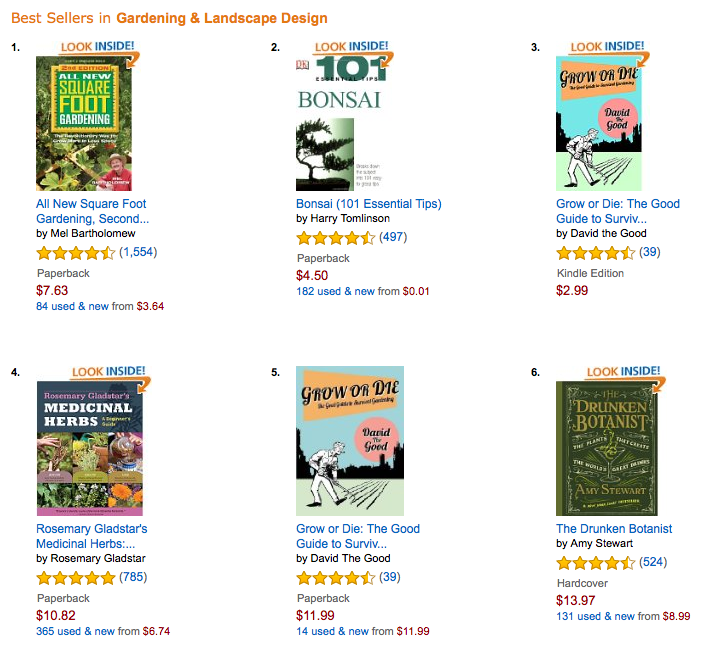
Locate an element on the screen. books is located at coordinates (90, 125), (351, 119), (614, 119), (624, 442), (346, 461), (90, 462).